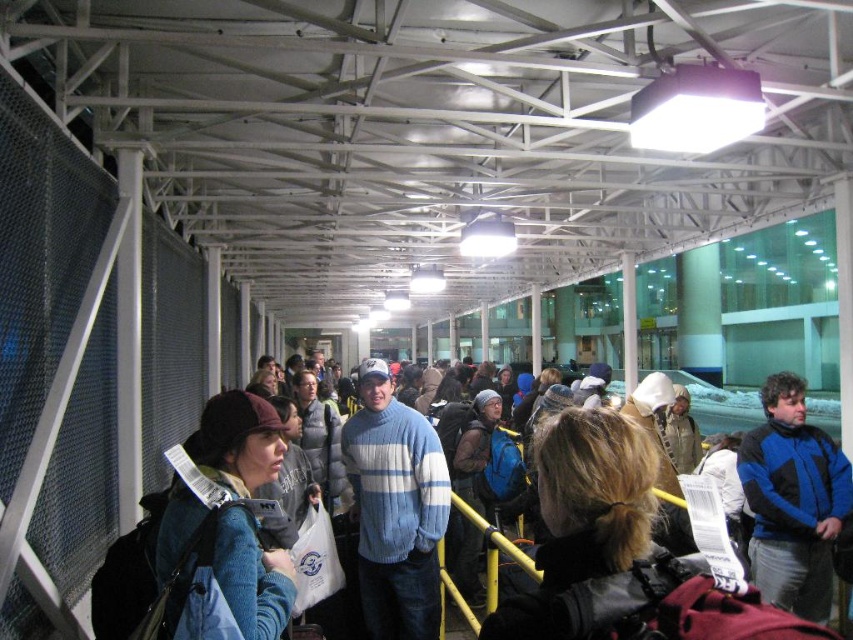
Who is lower down, cotton sweater at center or blue fleece jacket at center?

cotton sweater at center is lower down.

Can you confirm if cotton sweater at center is positioned to the left of blue fleece jacket at center?

Indeed, cotton sweater at center is positioned on the left side of blue fleece jacket at center.

Does point (416, 458) come in front of point (753, 554)?

Yes, point (416, 458) is in front of point (753, 554).

Where is `cotton sweater at center`? The width and height of the screenshot is (853, 640). cotton sweater at center is located at coordinates (395, 508).

Between blue fleece jacket at center and blue woolen sweater at center, which one has less height?

Standing shorter between the two is blue woolen sweater at center.

Which is more to the right, blue fleece jacket at center or blue woolen sweater at center?

Positioned to the right is blue fleece jacket at center.

Does point (802, 563) come in front of point (196, 499)?

No, it is not.

The width and height of the screenshot is (853, 640). In order to click on blue fleece jacket at center in this screenshot , I will do `click(792, 500)`.

Can you confirm if cotton sweater at center is positioned above blue woolen sweater at center?

No.

Where is `cotton sweater at center`? The width and height of the screenshot is (853, 640). cotton sweater at center is located at coordinates (395, 508).

This screenshot has height=640, width=853. Find the location of `cotton sweater at center`. cotton sweater at center is located at coordinates (395, 508).

This screenshot has height=640, width=853. Identify the location of cotton sweater at center. (395, 508).